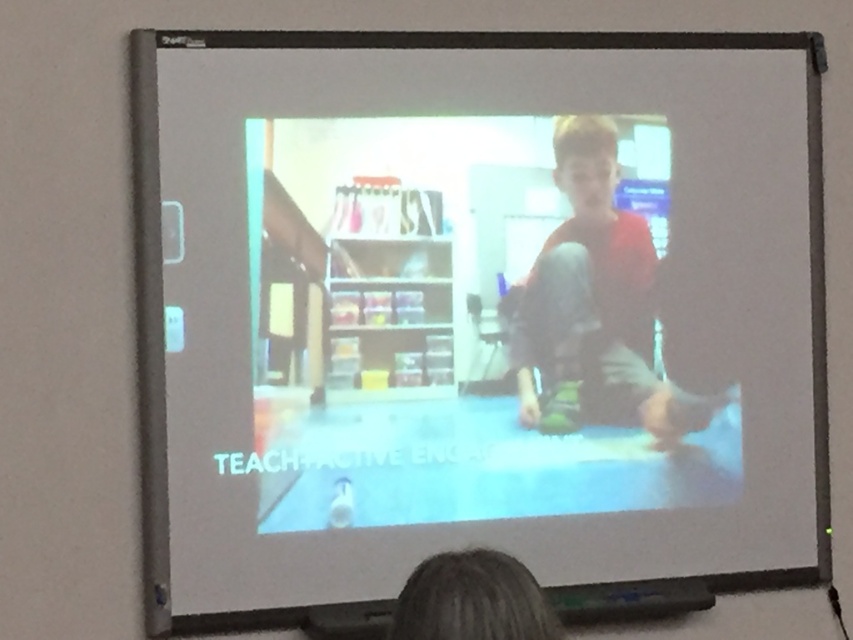
You are a student in the classroom looking at the projected screen. You notice a specific point on the screen at coordinates (596, 307). What object is located at that exact point on the screen?

The point at coordinates (596, 307) on the screen indicates the matte red shirt at center.

You are a student sitting in the classroom watching the projected screen. You need to know the distance between the matte red shirt at center and the blonde hair at lower center to determine if they belong to the same person. Can you confirm if they are part of the same individual?

The matte red shirt at center is 4.06 feet away from the blonde hair at lower center, which suggests they are likely part of the same person since the distance is reasonable for a shirt and hair on a human body.